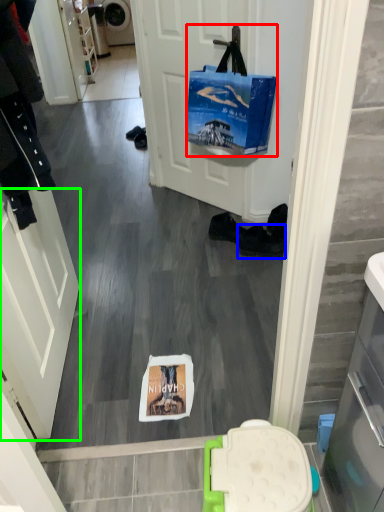
Question: Based on their relative distances, which object is farther from handbag (highlighted by a red box)? Choose from footwear (highlighted by a blue box) and screen door (highlighted by a green box).

Choices:
 (A) footwear
 (B) screen door

Answer: (B)